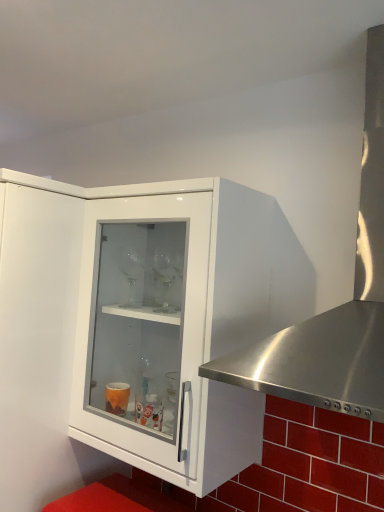
Question: Should I look upward or downward to see stainless steel range hood at right?

Choices:
 (A) down
 (B) up

Answer: (B)

Question: Should I look upward or downward to see white glossy cabinet at center?

Choices:
 (A) up
 (B) down

Answer: (B)

Question: From the image's perspective, is stainless steel range hood at right below white glossy cabinet at center?

Choices:
 (A) yes
 (B) no

Answer: (B)

Question: Considering the relative sizes of stainless steel range hood at right and white glossy cabinet at center in the image provided, is stainless steel range hood at right thinner than white glossy cabinet at center?

Choices:
 (A) yes
 (B) no

Answer: (B)

Question: Is the depth of stainless steel range hood at right less than that of white glossy cabinet at center?

Choices:
 (A) no
 (B) yes

Answer: (B)

Question: From a real-world perspective, does stainless steel range hood at right sit lower than white glossy cabinet at center?

Choices:
 (A) yes
 (B) no

Answer: (B)

Question: From the image's perspective, is stainless steel range hood at right located above white glossy cabinet at center?

Choices:
 (A) no
 (B) yes

Answer: (B)

Question: Does stainless steel range hood at right appear on the left side of white glossy cabinet at center?

Choices:
 (A) yes
 (B) no

Answer: (B)

Question: Is white glossy cabinet at center not inside stainless steel range hood at right?

Choices:
 (A) yes
 (B) no

Answer: (A)

Question: From a real-world perspective, does white glossy cabinet at center stand above stainless steel range hood at right?

Choices:
 (A) yes
 (B) no

Answer: (B)

Question: Does white glossy cabinet at center have a larger size compared to stainless steel range hood at right?

Choices:
 (A) yes
 (B) no

Answer: (B)

Question: Does white glossy cabinet at center have a lesser height compared to stainless steel range hood at right?

Choices:
 (A) no
 (B) yes

Answer: (A)

Question: Is white glossy cabinet at center positioned with its back to stainless steel range hood at right?

Choices:
 (A) no
 (B) yes

Answer: (A)

Question: From the image's perspective, is white glossy cabinet at center below stainless steel range hood at right?

Choices:
 (A) no
 (B) yes

Answer: (B)

Question: Based on their sizes in the image, would you say stainless steel range hood at right is bigger or smaller than white glossy cabinet at center?

Choices:
 (A) big
 (B) small

Answer: (A)